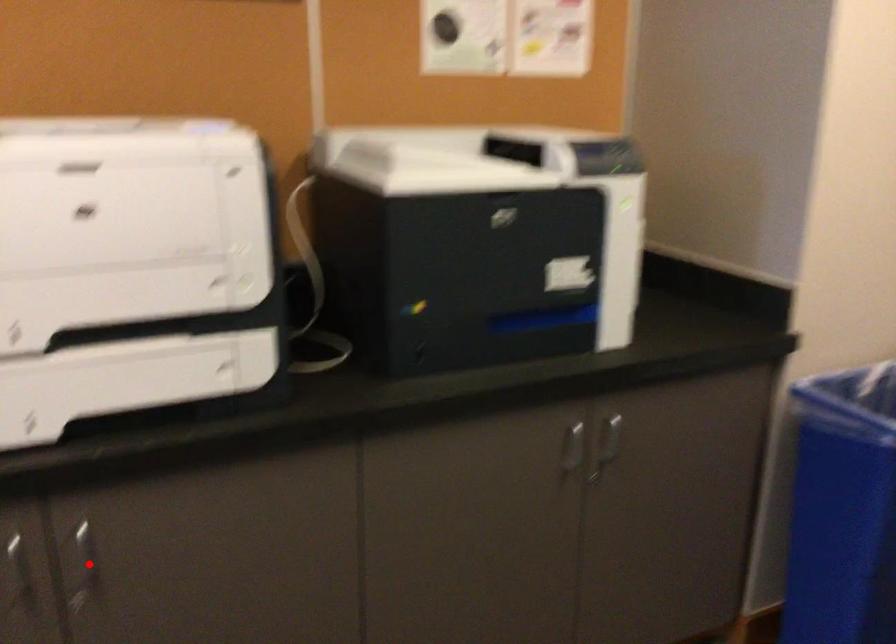
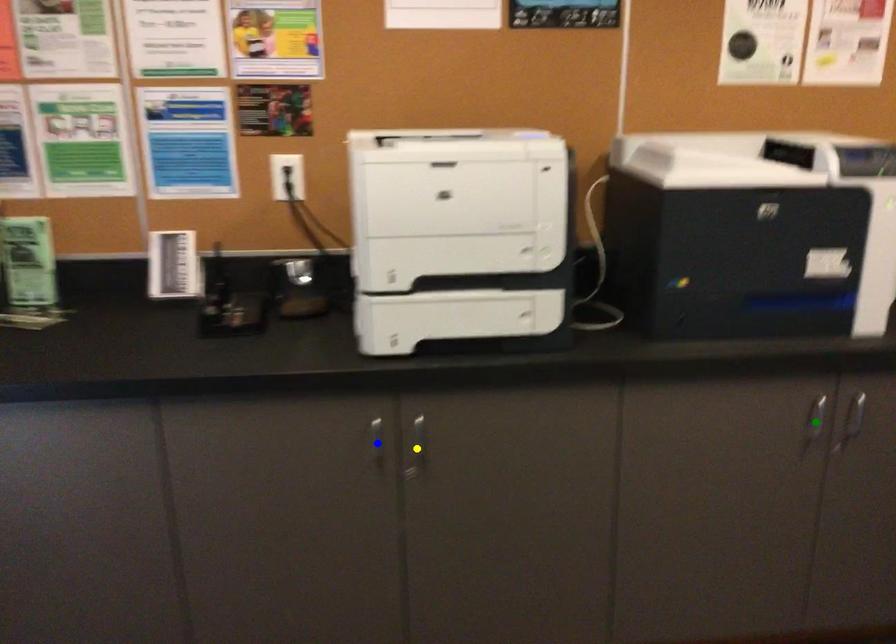
Question: I am providing you with two images of the same scene from different viewpoints. A red point is marked on the first image. You are given multiple points on the second image. Which point in image 2 is actually the same real-world point as the red point in image 1?

Choices:
 (A) yellow point
 (B) blue point
 (C) green point

Answer: (A)